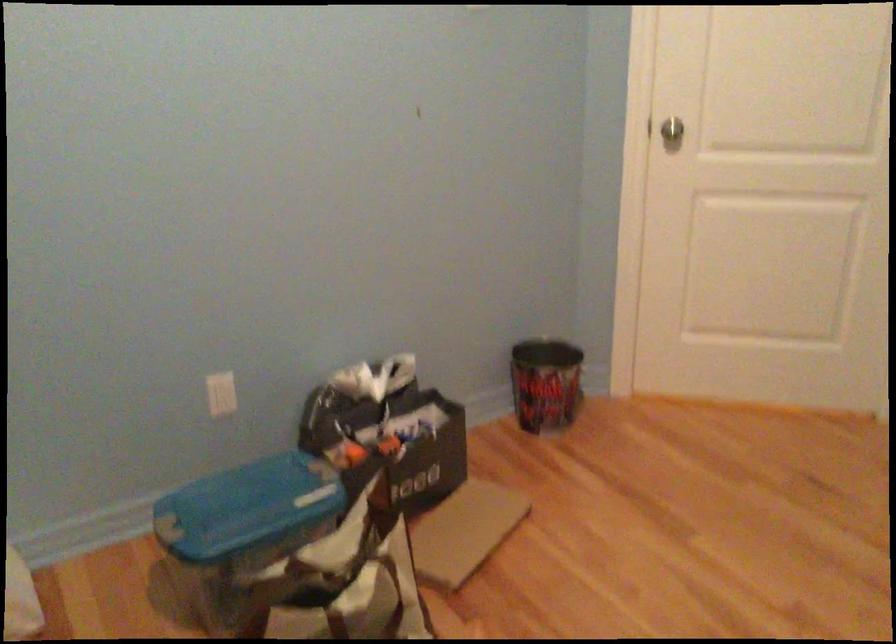
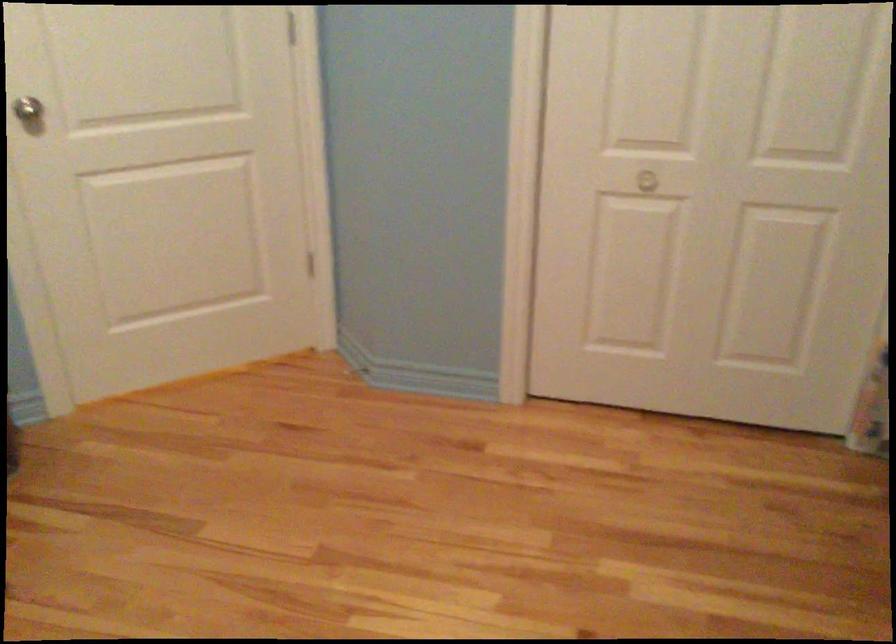
Find the pixel in the second image that matches pixel 676 133 in the first image.

(29, 111)